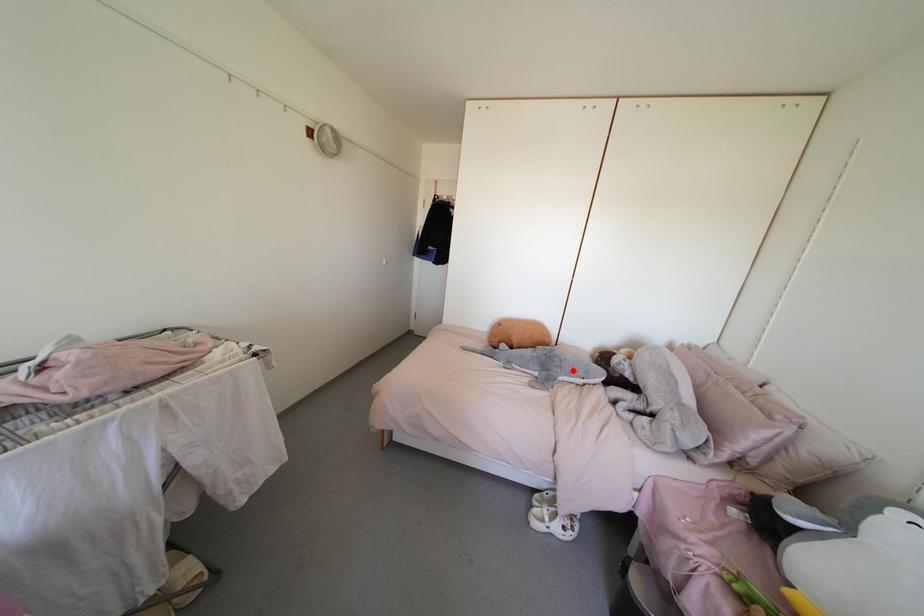
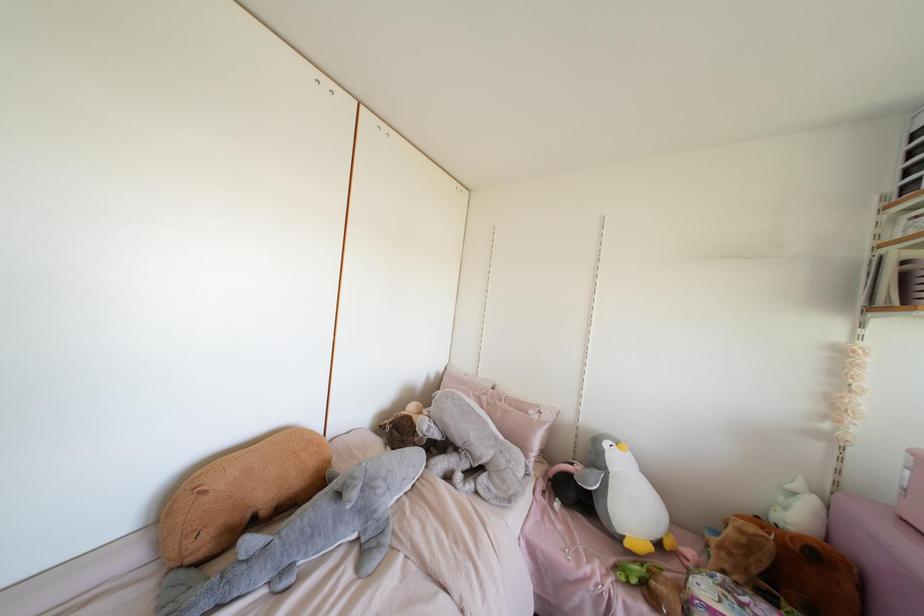
Locate, in the second image, the point that corresponds to the highlighted location in the first image.

(403, 479)